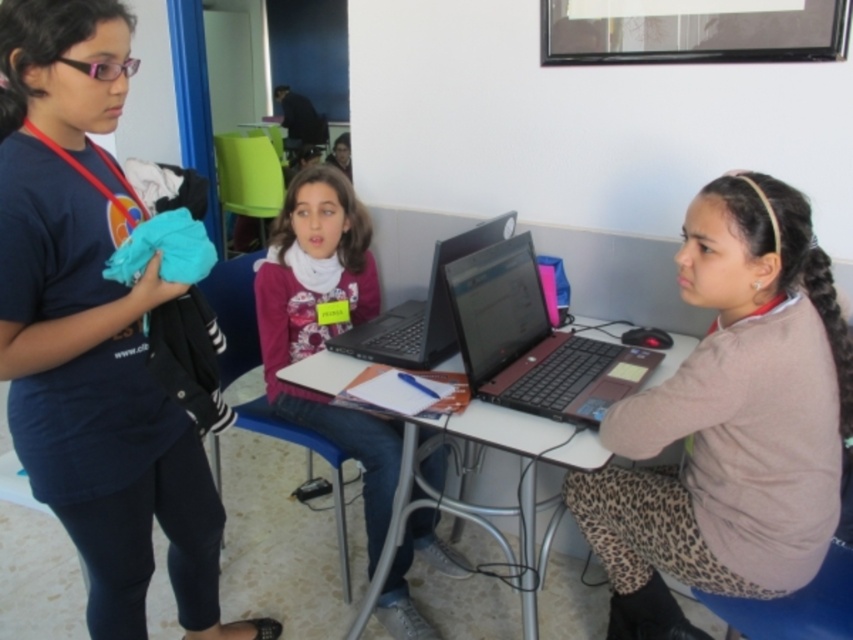
Who is more distant from viewer, (x=521, y=234) or (x=442, y=330)?

The point (x=521, y=234) is more distant.

The width and height of the screenshot is (853, 640). What do you see at coordinates (532, 340) in the screenshot? I see `matte black laptop at center` at bounding box center [532, 340].

The width and height of the screenshot is (853, 640). What are the coordinates of `matte black laptop at center` in the screenshot? It's located at tap(532, 340).

Consider the image. Is matte pink sweater at center further to the viewer compared to matte black laptop at center?

Yes, matte pink sweater at center is behind matte black laptop at center.

Image resolution: width=853 pixels, height=640 pixels. I want to click on matte pink sweater at center, so click(325, 324).

Is point (315, 301) closer to camera compared to point (544, 406)?

No, (315, 301) is further to viewer.

This screenshot has width=853, height=640. Identify the location of matte pink sweater at center. (325, 324).

Between matte pink sweater at center and matte plastic table at center, which one has less height?

With less height is matte plastic table at center.

Does matte pink sweater at center appear under matte plastic table at center?

Incorrect, matte pink sweater at center is not positioned below matte plastic table at center.

Is point (262, 358) behind point (314, 385)?

Yes, it is.

Find the location of `matte pink sweater at center`. matte pink sweater at center is located at coordinates (325, 324).